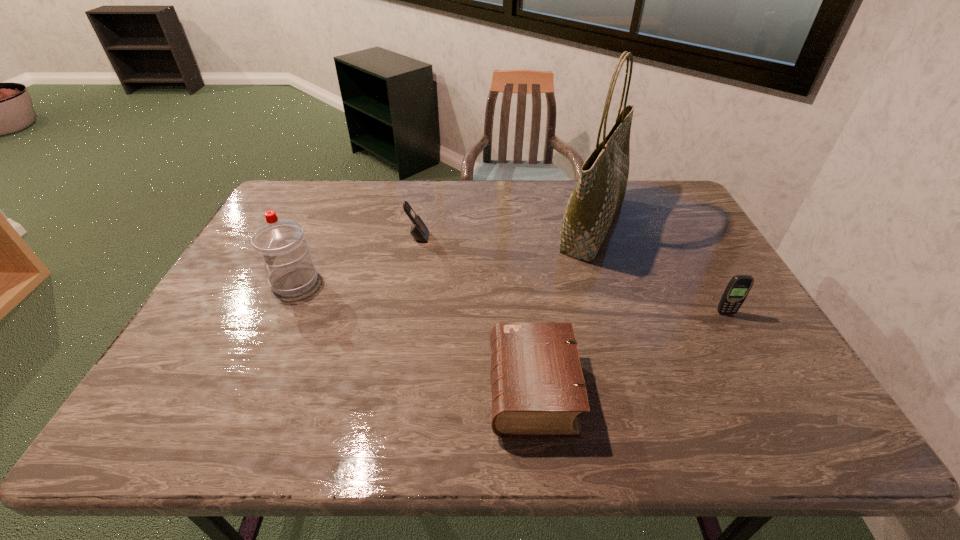
Identify the location of vacant region that satisfies the following two spatial constraints: 1. on the screen of the nearer cellular telephone; 2. on the spine side of the shortest object. The width and height of the screenshot is (960, 540). (769, 390).

This screenshot has width=960, height=540. I want to click on free space that satisfies the following two spatial constraints: 1. on the front side of the tallest object; 2. on the front-facing side of the left cellular telephone, so click(596, 237).

The width and height of the screenshot is (960, 540). Find the location of `vacant region that satisfies the following two spatial constraints: 1. on the screen of the right cellular telephone; 2. on the spine side of the shortest object`. vacant region that satisfies the following two spatial constraints: 1. on the screen of the right cellular telephone; 2. on the spine side of the shortest object is located at coordinates (769, 390).